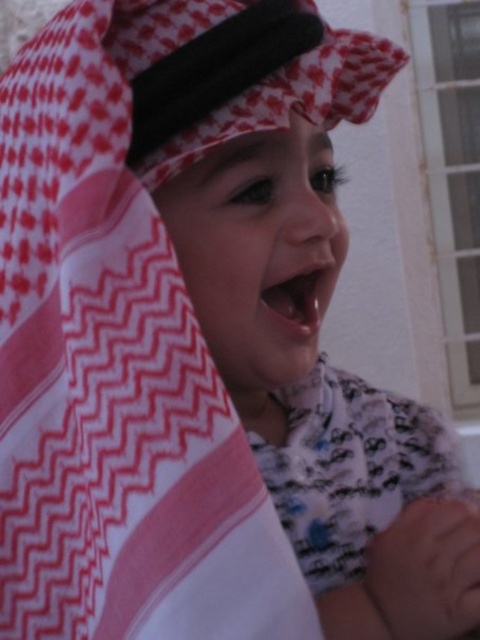
Question: Does white printed robe at center have a lesser width compared to smooth pink lips at center?

Choices:
 (A) no
 (B) yes

Answer: (A)

Question: Which point appears closest to the camera in this image?

Choices:
 (A) (298, 308)
 (B) (110, 144)
 (C) (302, 390)

Answer: (B)

Question: Observing the image, what is the correct spatial positioning of white woven cloth at center in reference to smooth pink lips at center?

Choices:
 (A) right
 (B) left

Answer: (B)

Question: Which point is closer to the camera taking this photo?

Choices:
 (A) (79, 115)
 (B) (334, 538)

Answer: (A)

Question: Can you confirm if white woven cloth at center is positioned below smooth pink lips at center?

Choices:
 (A) yes
 (B) no

Answer: (A)

Question: Which object is the farthest from the white woven cloth at center?

Choices:
 (A) white printed robe at center
 (B) smooth pink lips at center

Answer: (A)